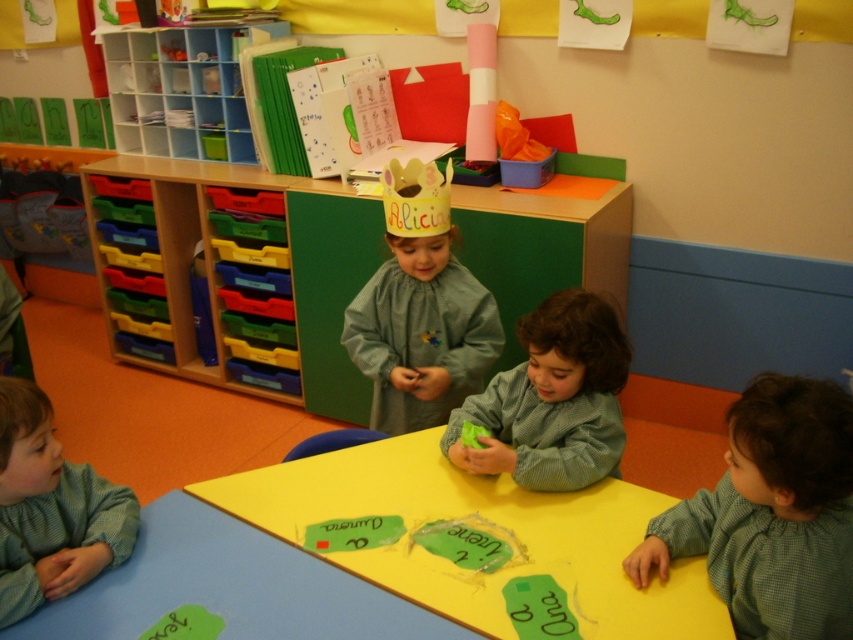
You are a teacher in the classroom and want to place a sticker on the table between the two points labeled point (393, 406) and point (564, 484). Based on their positions, which point is closer to the front of the classroom?

Point (564, 484) is closer to the front of the classroom because it is in front of point (393, 406).

You are a teacher in the classroom and need to decide which clothing item to use for a costume activity. The costume requires a larger garment. Which one should you choose between the matte gray dress at center and the green knitted sweater at center?

The matte gray dress at center is bigger than the green knitted sweater at center, so you should choose the matte gray dress at center for the costume activity.